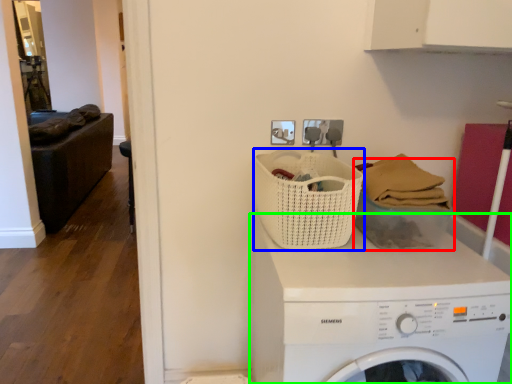
Question: Which is nearer to the basket (highlighted by a red box)? basket (highlighted by a blue box) or washing machine (highlighted by a green box).

Choices:
 (A) basket
 (B) washing machine

Answer: (A)